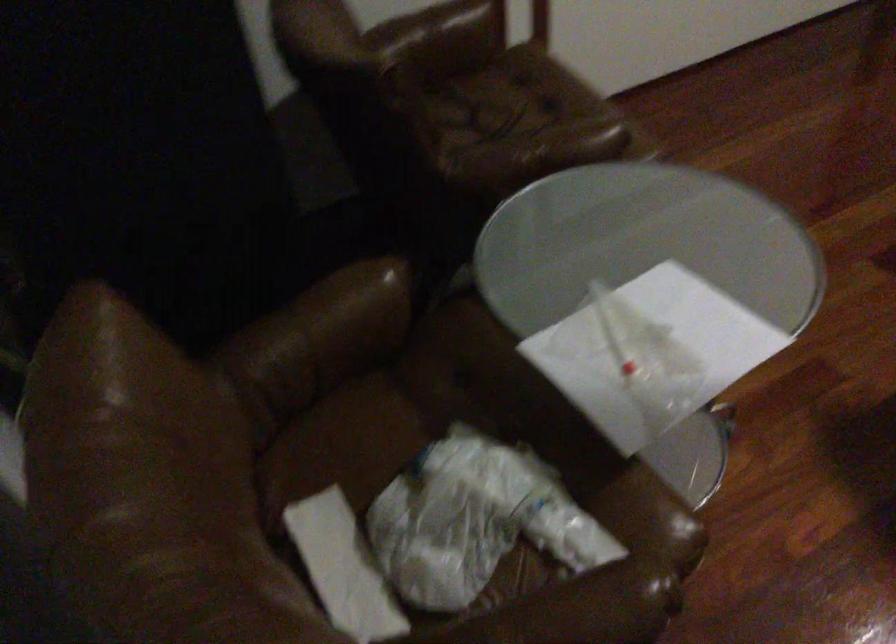
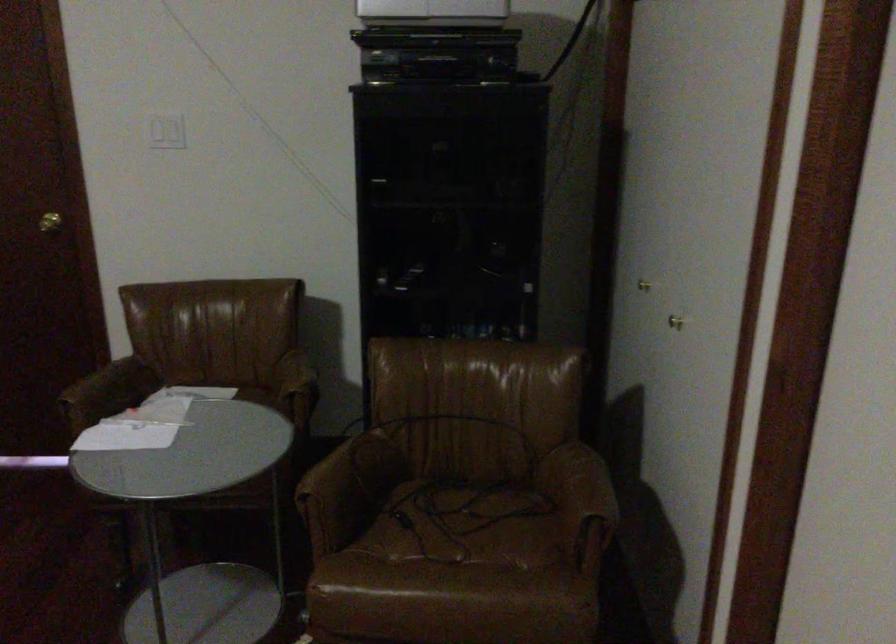
Find the pixel in the second image that matches (613,152) in the first image.

(312, 513)